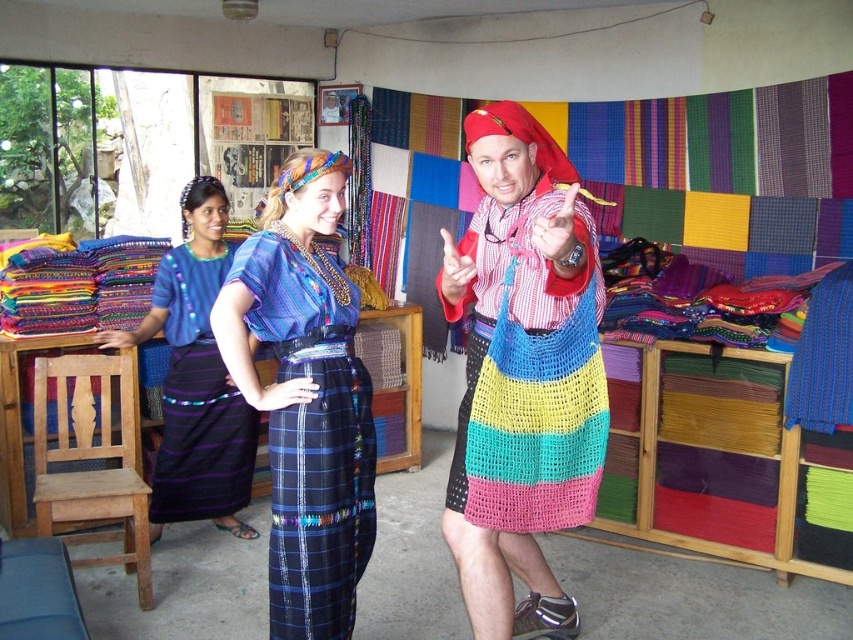
Question: Which point is closer to the camera taking this photo?

Choices:
 (A) (561, 337)
 (B) (329, 401)

Answer: (A)

Question: Considering the real-world distances, which object is farthest from the matte blue fabric dress at center?

Choices:
 (A) multicolored knitted bag at center
 (B) blue plaid skirt at center

Answer: (B)

Question: Which of these objects is positioned farthest from the blue plaid skirt at center?

Choices:
 (A) multicolored knitted bag at center
 (B) matte blue fabric dress at center

Answer: (A)

Question: Does matte blue fabric dress at center appear under blue plaid skirt at center?

Choices:
 (A) no
 (B) yes

Answer: (B)

Question: Can you confirm if multicolored knitted bag at center is positioned below blue plaid skirt at center?

Choices:
 (A) no
 (B) yes

Answer: (A)

Question: Where is multicolored knitted bag at center located in relation to blue plaid skirt at center in the image?

Choices:
 (A) above
 (B) below

Answer: (A)